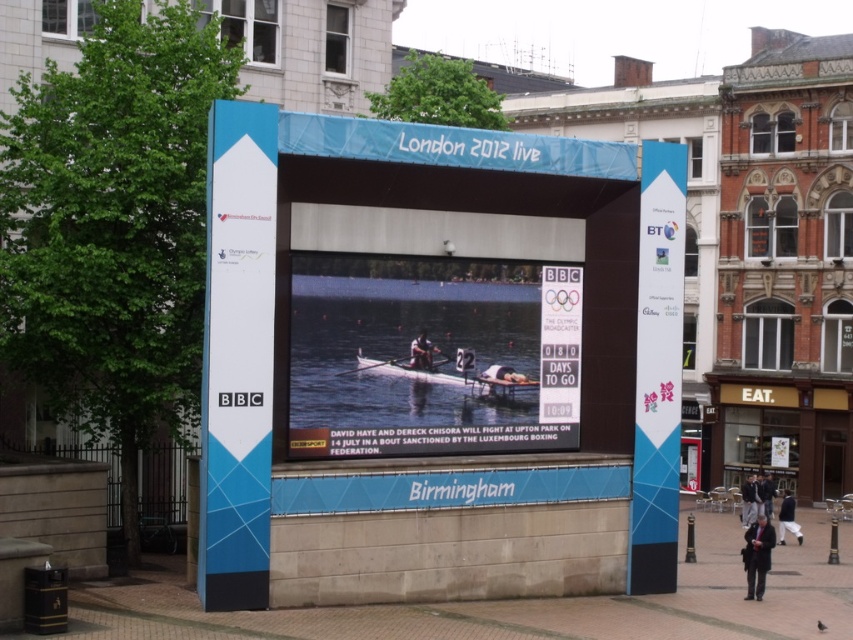
You are standing in front of the London 2012 live display and want to locate the dark blue jacket at center. According to the coordinates provided, where should you look on the display?

The dark blue jacket at center is located at point 0.783 on the x axis and 0.880 on the y axis.

You are a spectator at the London 2012 live event. You see the blue plastic sign at right and the matte black rower at center. Which object is positioned more to the east if the display faces north?

The blue plastic sign at right is to the right of matte black rower at center. Since the display faces north, the right side would correspond to the east direction, so the blue plastic sign at right is positioned more to the east.